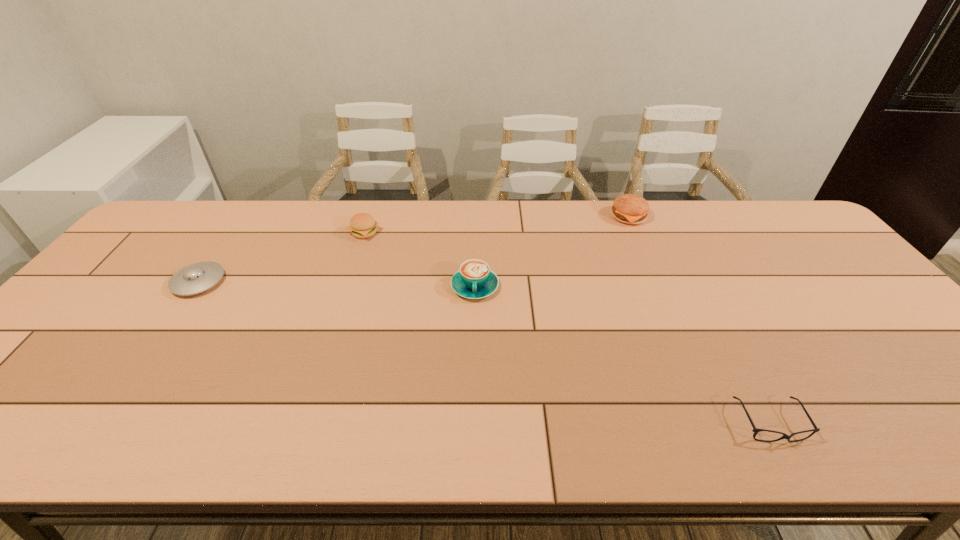
Locate an element on the screen. Image resolution: width=960 pixels, height=540 pixels. the right hamburger is located at coordinates (627, 208).

What are the coordinates of `the left hamburger` in the screenshot? It's located at (362, 225).

You are a GUI agent. You are given a task and a screenshot of the screen. Output one action in this format:
    pyautogui.click(x=<x>, y=<y>)
    Task: Click on the third object from left to right
    
    Given the screenshot: What is the action you would take?
    pyautogui.click(x=474, y=280)

Locate an element on the screen. The width and height of the screenshot is (960, 540). saucer is located at coordinates (195, 278).

Where is `spectacles`? spectacles is located at coordinates (755, 430).

The height and width of the screenshot is (540, 960). What are the coordinates of `free space located 0.200m on the left of the right hamburger` in the screenshot? It's located at (551, 217).

You are a GUI agent. You are given a task and a screenshot of the screen. Output one action in this format:
    pyautogui.click(x=<x>, y=<y>)
    Task: Click on the vacant space situated 0.100m on the right of the second object from left to right
    The height and width of the screenshot is (540, 960).
    Given the screenshot: What is the action you would take?
    pyautogui.click(x=412, y=233)

The image size is (960, 540). I want to click on vacant space located with the handle on the right side of the cappuccino, so click(474, 335).

Locate an element on the screen. The width and height of the screenshot is (960, 540). free region located 0.370m on the front of the saucer is located at coordinates (99, 425).

Where is `object that is at the near edge`? This screenshot has width=960, height=540. object that is at the near edge is located at coordinates (755, 430).